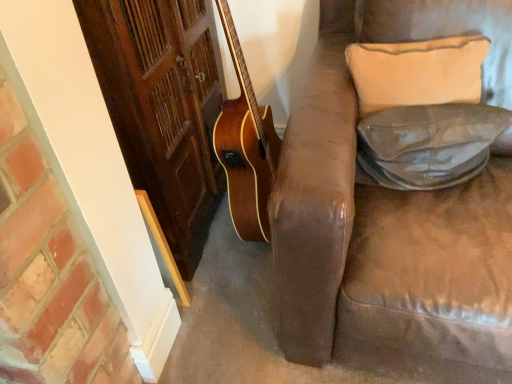
Question: In terms of height, does beige fabric pillow at upper right, the second pillow when ordered from bottom to top, look taller or shorter compared to leather at right, positioned as the 1th pillow in bottom-to-top order?

Choices:
 (A) short
 (B) tall

Answer: (B)

Question: Is beige fabric pillow at upper right, positioned as the first pillow in top-to-bottom order, inside or outside of leather at right, positioned as the 1th pillow in bottom-to-top order?

Choices:
 (A) inside
 (B) outside

Answer: (B)

Question: Based on their positions, is beige fabric pillow at upper right, positioned as the first pillow in top-to-bottom order, located to the left or right of leather at right, positioned as the 1th pillow in bottom-to-top order?

Choices:
 (A) right
 (B) left

Answer: (B)

Question: Does point (468, 173) appear closer or farther from the camera than point (440, 39)?

Choices:
 (A) closer
 (B) farther

Answer: (B)

Question: Considering their positions, is leather at right, positioned as the 1th pillow in bottom-to-top order, located in front of or behind beige fabric pillow at upper right, the second pillow when ordered from bottom to top?

Choices:
 (A) front
 (B) behind

Answer: (A)

Question: From a real-world perspective, relative to beige fabric pillow at upper right, positioned as the first pillow in top-to-bottom order, is leather at right, positioned as the 1th pillow in bottom-to-top order, vertically above or below?

Choices:
 (A) below
 (B) above

Answer: (A)

Question: In terms of width, does leather at right, positioned as the 1th pillow in bottom-to-top order, look wider or thinner when compared to beige fabric pillow at upper right, the second pillow when ordered from bottom to top?

Choices:
 (A) thin
 (B) wide

Answer: (A)